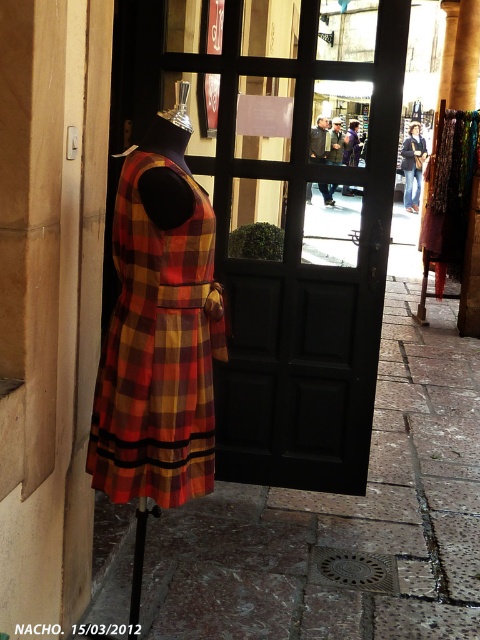
You are a delivery person trying to maneuver a cart through the shop entrance. The cart is as wide as the plaid fabric dress at left. Can the cart pass through the entrance without touching the marble pavement at center?

The marble pavement at center is wider than the plaid fabric dress at left. Since the cart is as wide as the dress, it can pass through the entrance without touching the pavement because the pavement is wider than the cart.

You are a delivery person with a cart that is 1.8 meters wide. You need to navigate through the space between the marble pavement at center and the plaid fabric dress at left to deliver a package. Can your cart fit through this space?

The distance between the marble pavement at center and the plaid fabric dress at left is 1.68 meters. Since your cart is 1.8 meters wide, it cannot fit through the space as it is narrower than the cart.